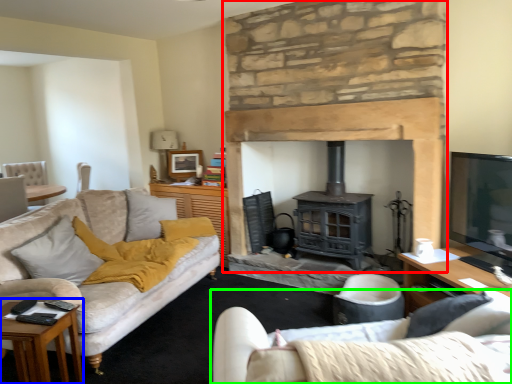
Question: Which object is the closest to the fireplace (highlighted by a red box)? Choose among these: table (highlighted by a blue box) or studio couch (highlighted by a green box).

Choices:
 (A) table
 (B) studio couch

Answer: (B)